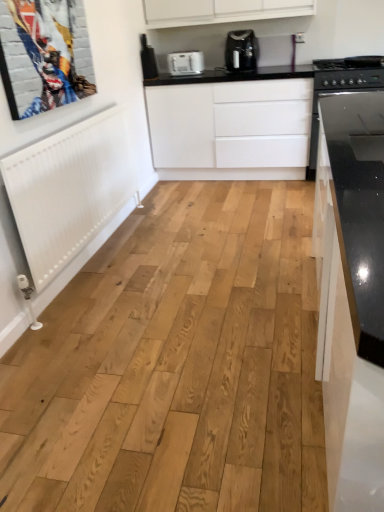
Question: Considering the positions of white matte cabinet at center and black glass stove at right in the image, is white matte cabinet at center wider or thinner than black glass stove at right?

Choices:
 (A) thin
 (B) wide

Answer: (A)

Question: Is point [x=284, y=141] closer or farther from the camera than point [x=380, y=84]?

Choices:
 (A) farther
 (B) closer

Answer: (A)

Question: Which object is positioned farthest from the satin black coffee maker at upper center?

Choices:
 (A) white matte cabinet at center
 (B) metallic silver picture frame at upper left
 (C) white plastic toaster at upper center
 (D) black glass stove at right

Answer: (B)

Question: Which object is positioned farthest from the satin black coffee maker at upper center?

Choices:
 (A) black glass stove at right
 (B) white matte cabinet at center
 (C) white plastic toaster at upper center
 (D) metallic silver picture frame at upper left

Answer: (D)